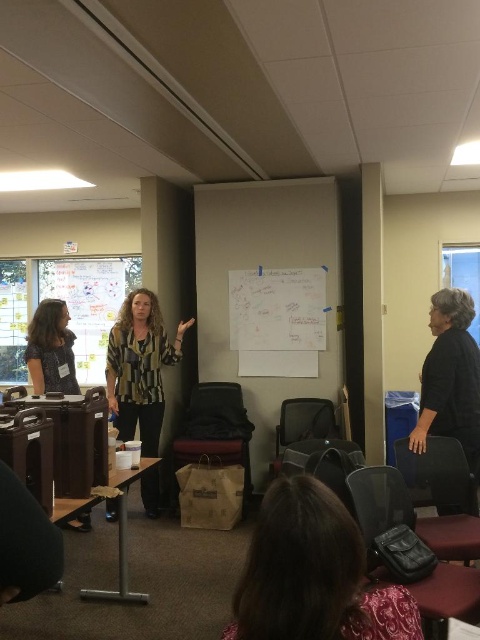
Question: Does dark brown leather bag at lower center appear on the left side of striped fabric blouse at center?

Choices:
 (A) yes
 (B) no

Answer: (B)

Question: Which point is closer to the camera?

Choices:
 (A) matte black shirt at left
 (B) striped fabric blouse at center
 (C) dark brown leather bag at lower center

Answer: (C)

Question: Which object is closer to the camera taking this photo?

Choices:
 (A) striped fabric blouse at center
 (B) dark brown leather bag at lower center
 (C) matte black shirt at left

Answer: (B)

Question: Does dark brown leather bag at lower center have a larger size compared to striped fabric blouse at center?

Choices:
 (A) yes
 (B) no

Answer: (B)

Question: Which of the following is the farthest from the observer?

Choices:
 (A) pos(49,326)
 (B) pos(288,604)

Answer: (A)

Question: Is dark brown leather bag at lower center in front of striped fabric blouse at center?

Choices:
 (A) yes
 (B) no

Answer: (A)